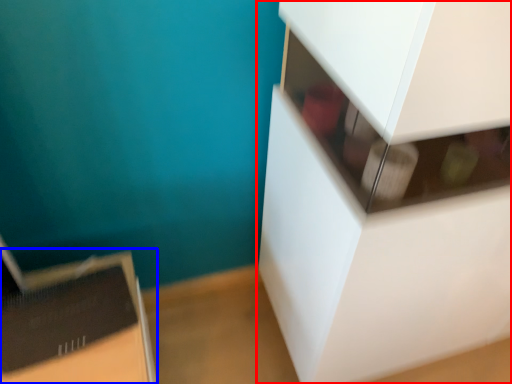
Question: Which point is further to the camera, furniture (highlighted by a red box) or cardboard box (highlighted by a blue box)?

Choices:
 (A) furniture
 (B) cardboard box

Answer: (B)